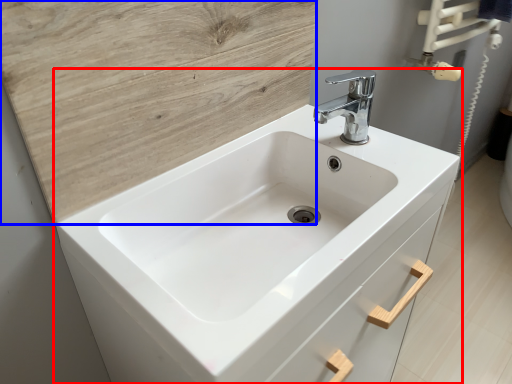
Question: Which object is further to the camera taking this photo, sink (highlighted by a red box) or plywood (highlighted by a blue box)?

Choices:
 (A) sink
 (B) plywood

Answer: (B)